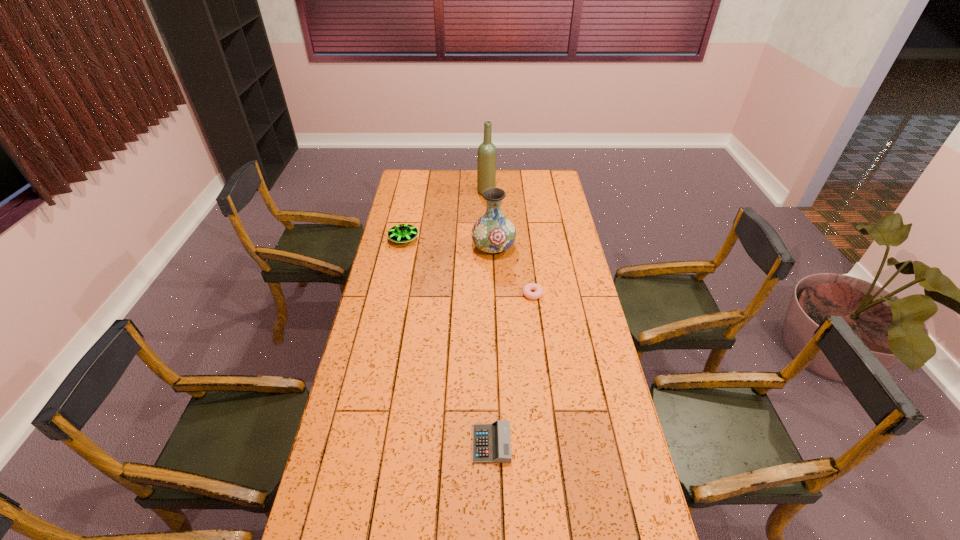
Locate an element on the screen. This screenshot has width=960, height=540. vacant point located between the calculator and the tallest object is located at coordinates (489, 318).

Find the location of a particular element. vacant area between the second tallest object and the calculator is located at coordinates (492, 346).

Locate an element on the screen. The width and height of the screenshot is (960, 540). vacant area that lies between the tallest object and the third tallest object is located at coordinates (445, 215).

I want to click on free spot between the vase and the doughnut, so click(513, 271).

Locate an element on the screen. free space between the saucer and the nearest object is located at coordinates (447, 342).

Identify the location of vacant space in between the third tallest object and the doughnut. Image resolution: width=960 pixels, height=540 pixels. (468, 267).

You are a GUI agent. You are given a task and a screenshot of the screen. Output one action in this format:
    pyautogui.click(x=<x>, y=<y>)
    Task: Click on the empty location between the tallest object and the leftmost object
    This screenshot has height=540, width=960.
    Given the screenshot: What is the action you would take?
    pyautogui.click(x=445, y=215)

This screenshot has height=540, width=960. I want to click on object that is the third closest to the calculator, so click(402, 233).

Locate an element on the screen. This screenshot has width=960, height=540. the third closest object relative to the vase is located at coordinates (486, 163).